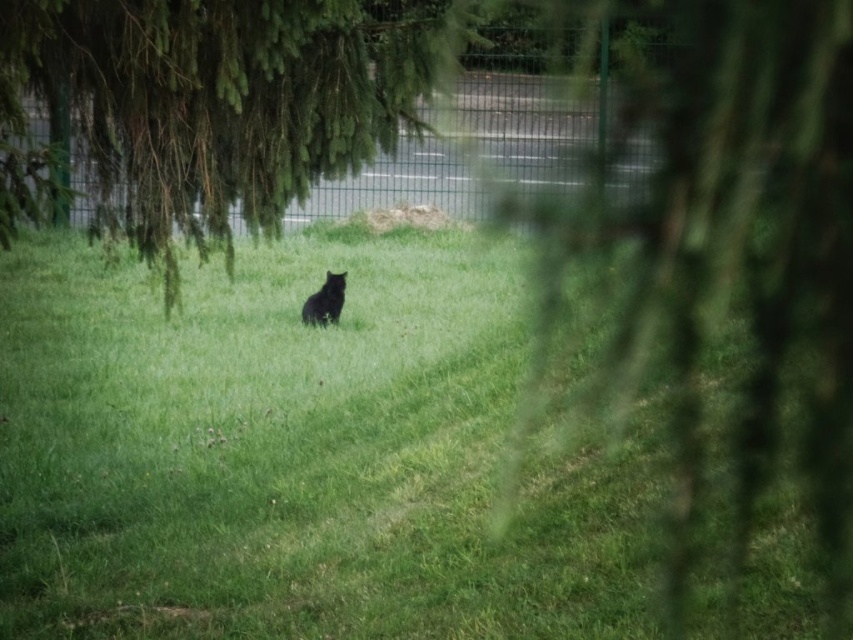
You are standing at the point with coordinates point (328, 314) and want to walk towards the point (370, 141). According to the scene, will you be moving towards the black cat sitting in the middle?

Yes, because point (370, 141) is in front of point (328, 314), meaning moving towards it would be heading in the direction of the black cat in the middle.